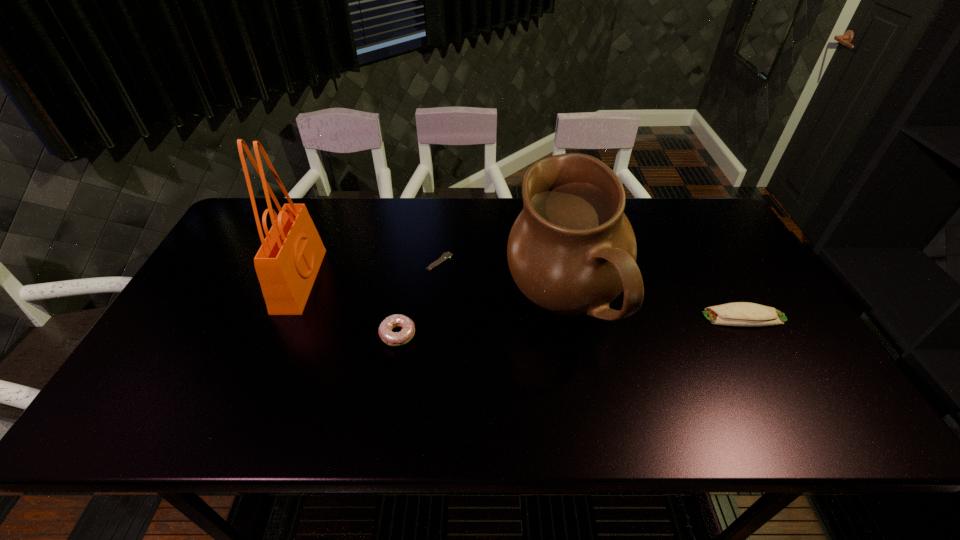
What are the coordinates of `free space between the fourth object from left to right and the fourth object from right to left` in the screenshot? It's located at (481, 320).

Locate an element on the screen. The height and width of the screenshot is (540, 960). free space between the third object from right to left and the leftmost object is located at coordinates (370, 271).

Select which object appears as the third closest to the cream pitcher. Please provide its 2D coordinates. Your answer should be formatted as a tuple, i.e. [(x, y)], where the tuple contains the x and y coordinates of a point satisfying the conditions above.

[(407, 332)]

You are a GUI agent. You are given a task and a screenshot of the screen. Output one action in this format:
    pyautogui.click(x=<x>, y=<y>)
    Task: Click on the object that is the closest to the burrito
    The image size is (960, 540).
    Given the screenshot: What is the action you would take?
    pyautogui.click(x=572, y=250)

The width and height of the screenshot is (960, 540). What are the coordinates of `free space that satisfies the following two spatial constraints: 1. at the bitten end of the burrito; 2. on the front side of the third tallest object` in the screenshot? It's located at (754, 334).

The width and height of the screenshot is (960, 540). I want to click on vacant space that satisfies the following two spatial constraints: 1. on the logo side of the leftmost object; 2. on the left side of the doughnut, so click(x=277, y=334).

Where is `vacant position in the image that satisfies the following two spatial constraints: 1. at the bitten end of the burrito; 2. on the front side of the doughnut`? vacant position in the image that satisfies the following two spatial constraints: 1. at the bitten end of the burrito; 2. on the front side of the doughnut is located at coordinates (754, 334).

Find the location of a particular element. The image size is (960, 540). free space that satisfies the following two spatial constraints: 1. on the logo side of the tote bag; 2. on the back side of the fourth object from right to left is located at coordinates (277, 334).

This screenshot has width=960, height=540. I want to click on free spot that satisfies the following two spatial constraints: 1. at the bitten end of the burrito; 2. on the front side of the fourth object from right to left, so click(754, 334).